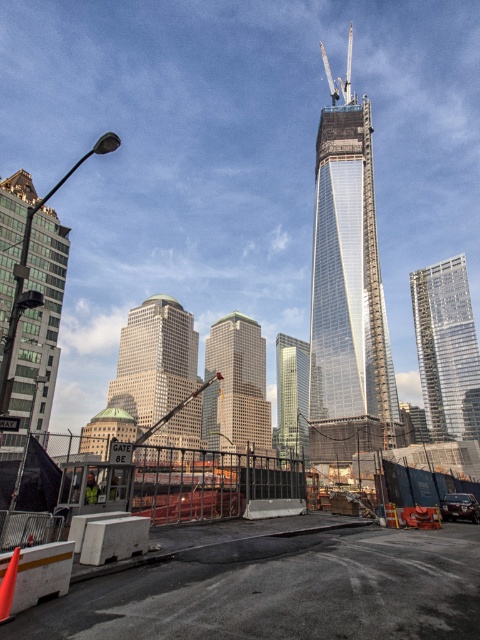
You are a delivery driver arriving at the construction site. You need to park your truck near the yellow reflective safety vest at lower left but want to ensure there is enough space between it and the green glass building at center. Can you confirm if the space between them is sufficient for your truck?

The green glass building at center is wider than the yellow reflective safety vest at lower left. However, the description only provides information about their widths, not the distance between them. Therefore, it is unclear if there is enough space for the truck between them based on the given details.

You are a delivery driver approaching the construction site and need to navigate around the concrete barrier at center and the yellow reflective safety vest at lower left. Which object should you avoid first if you want to take the shortest path to the entrance near Gate 8E?

The concrete barrier at center is bigger than the yellow reflective safety vest at lower left, so you should avoid the concrete barrier at center first to take the shortest path to the entrance near Gate 8E.